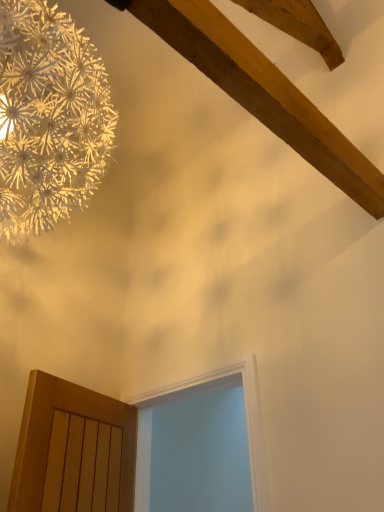
I want to click on white paper flower at upper left, so [x=49, y=118].

The width and height of the screenshot is (384, 512). What do you see at coordinates (49, 118) in the screenshot? I see `white paper flower at upper left` at bounding box center [49, 118].

Locate an element on the screen. Image resolution: width=384 pixels, height=512 pixels. white paper flower at upper left is located at coordinates (49, 118).